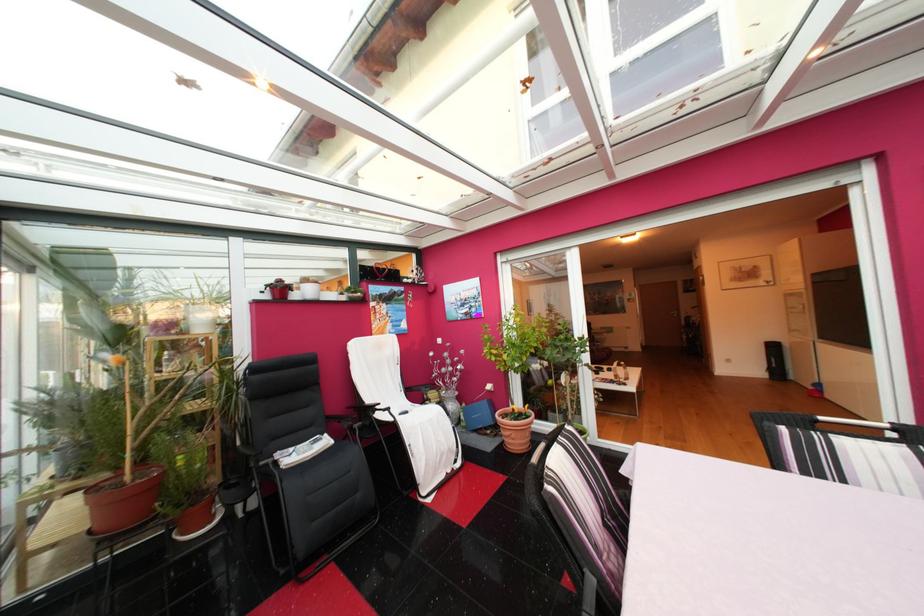
Find the location of a particular element. This screenshot has height=616, width=924. terracotta plant pot is located at coordinates (123, 500).